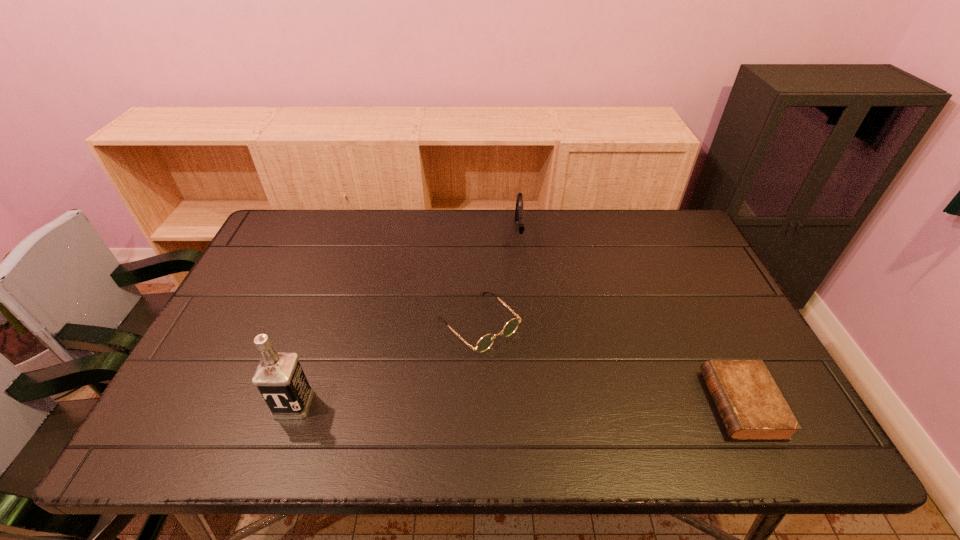
Where is `vacant space situated on the spine side of the diary`? The image size is (960, 540). vacant space situated on the spine side of the diary is located at coordinates (668, 404).

Identify the location of free spot located 0.150m on the lenses of the third nearest object. This screenshot has width=960, height=540. (546, 390).

Identify the location of free point located 0.150m on the lenses of the third nearest object. (546, 390).

The image size is (960, 540). I want to click on vacant space situated at the aiming end of the third shortest object, so click(522, 268).

The height and width of the screenshot is (540, 960). Identify the location of free space located 0.050m at the aiming end of the third shortest object. click(522, 264).

This screenshot has width=960, height=540. In order to click on free space located at the aiming end of the third shortest object in this screenshot , I will do `click(523, 299)`.

Find the location of `object situated at the far edge`. object situated at the far edge is located at coordinates (519, 213).

I want to click on vodka located in the near edge section of the desktop, so click(x=279, y=377).

The image size is (960, 540). In order to click on diary located in the near edge section of the desktop in this screenshot , I will do `click(750, 404)`.

Where is `object that is at the right edge`? This screenshot has width=960, height=540. object that is at the right edge is located at coordinates (750, 404).